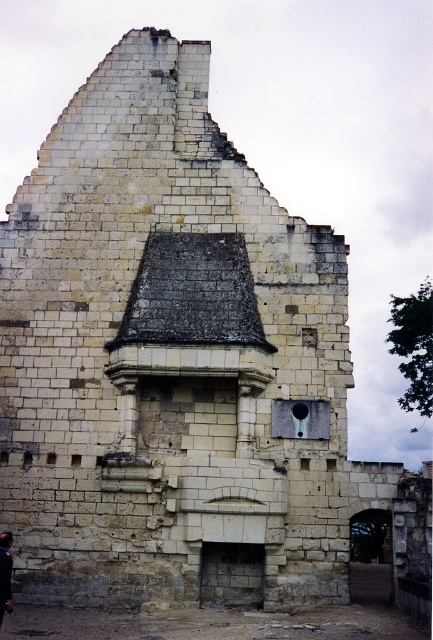
You are standing in front of the historic stone building and notice a smooth brown leather bag at lower left and black hair at upper center. Which object is positioned lower in the scene?

The smooth brown leather bag at lower left is positioned lower than the black hair at upper center.

Consider the image. You are an archaeologist examining the historic stone building. You notice a smooth brown leather bag at lower left and a black hair at upper center. Which object has a greater width?

The smooth brown leather bag at lower left has a greater width than the black hair at upper center.